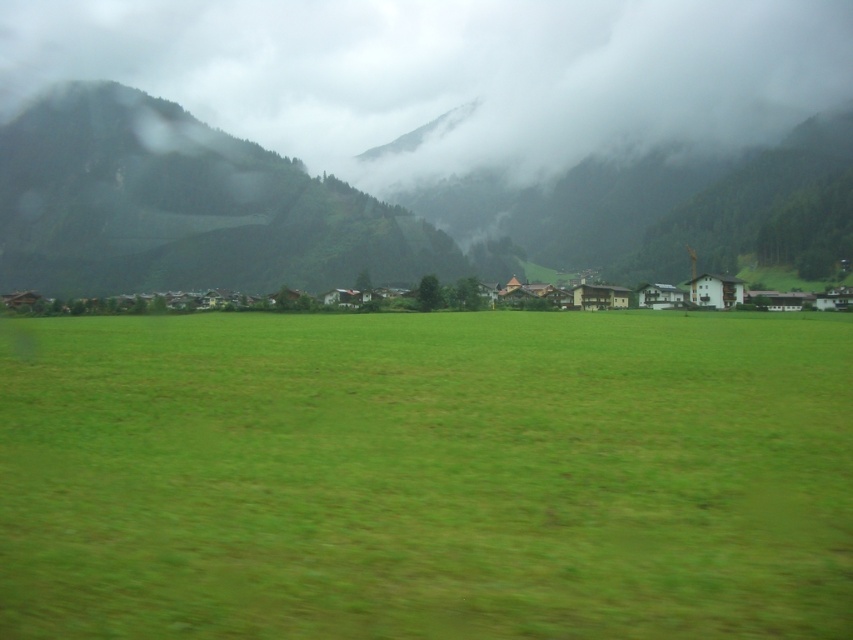
Question: Based on their relative distances, which object is nearer to the green forested mountain at upper left?

Choices:
 (A) green grassy field at center
 (B) white wooden houses at center

Answer: (B)

Question: Which object is the closest to the green grassy field at center?

Choices:
 (A) green forested mountain at upper left
 (B) white wooden houses at center

Answer: (B)

Question: Does green grassy field at center appear under green forested mountain at upper left?

Choices:
 (A) yes
 (B) no

Answer: (A)

Question: Which point is closer to the camera?

Choices:
 (A) green grassy field at center
 (B) green forested mountain at upper left

Answer: (A)

Question: Can you confirm if green grassy field at center is positioned to the left of green forested mountain at upper left?

Choices:
 (A) no
 (B) yes

Answer: (A)

Question: Where is green grassy field at center located in relation to white wooden houses at center in the image?

Choices:
 (A) left
 (B) right

Answer: (B)